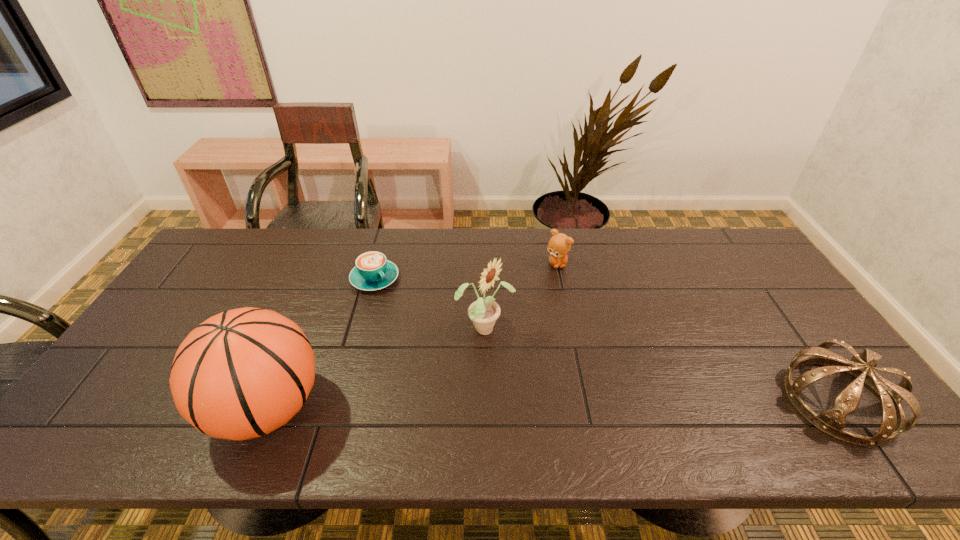
This screenshot has height=540, width=960. What are the coordinates of `blank space located 0.150m on the face of the fourth tallest object` in the screenshot? It's located at (572, 303).

What are the coordinates of `free region located on the face of the fourth tallest object` in the screenshot? It's located at (571, 301).

At what (x,y) coordinates should I click in order to perform the action: click on free space located on the face of the fourth tallest object. Please return your answer as a coordinate pair (x, y). The height and width of the screenshot is (540, 960). Looking at the image, I should click on (590, 350).

Find the location of `vacant space located with the handle on the right side of the cappuccino`. vacant space located with the handle on the right side of the cappuccino is located at coordinates (410, 315).

Where is `free region located with the handle on the right side of the cappuccino`? The height and width of the screenshot is (540, 960). free region located with the handle on the right side of the cappuccino is located at coordinates (438, 344).

Identify the location of free point located 0.150m with the handle on the right side of the cappuccino. 414,319.

Find the location of a particular element. vacant region located 0.160m on the front-facing side of the third nearest object is located at coordinates click(x=559, y=368).

You are a GUI agent. You are given a task and a screenshot of the screen. Output one action in this format:
    pyautogui.click(x=<x>, y=<y>)
    Task: Click on the vacant region located on the front-facing side of the third nearest object
    This screenshot has width=960, height=540.
    Given the screenshot: What is the action you would take?
    pyautogui.click(x=540, y=357)

You are a GUI agent. You are given a task and a screenshot of the screen. Output one action in this format:
    pyautogui.click(x=<x>, y=<y>)
    Task: Click on the free region located on the front-facing side of the third nearest object
    The height and width of the screenshot is (540, 960).
    Given the screenshot: What is the action you would take?
    (602, 393)

Find the location of a particular element. teddy bear present at the far edge is located at coordinates (559, 245).